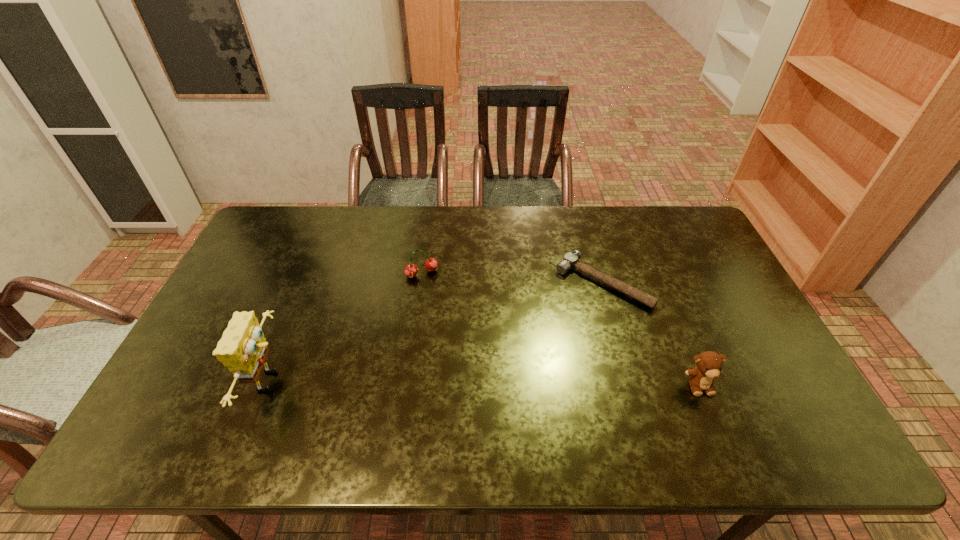
Select which object is the closest to the second object from left to right. Please provide its 2D coordinates. Your answer should be formatted as a tuple, i.e. [(x, y)], where the tuple contains the x and y coordinates of a point satisfying the conditions above.

[(243, 349)]